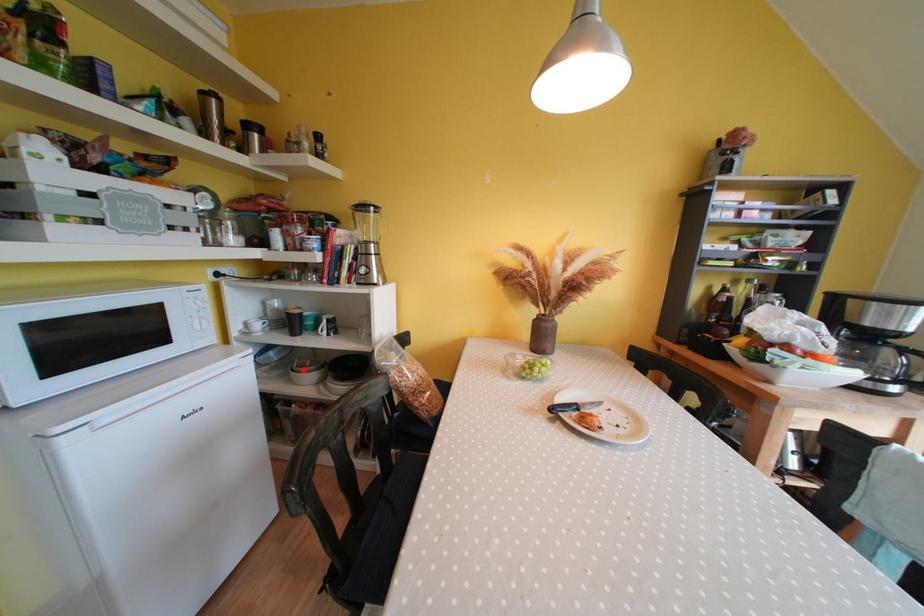
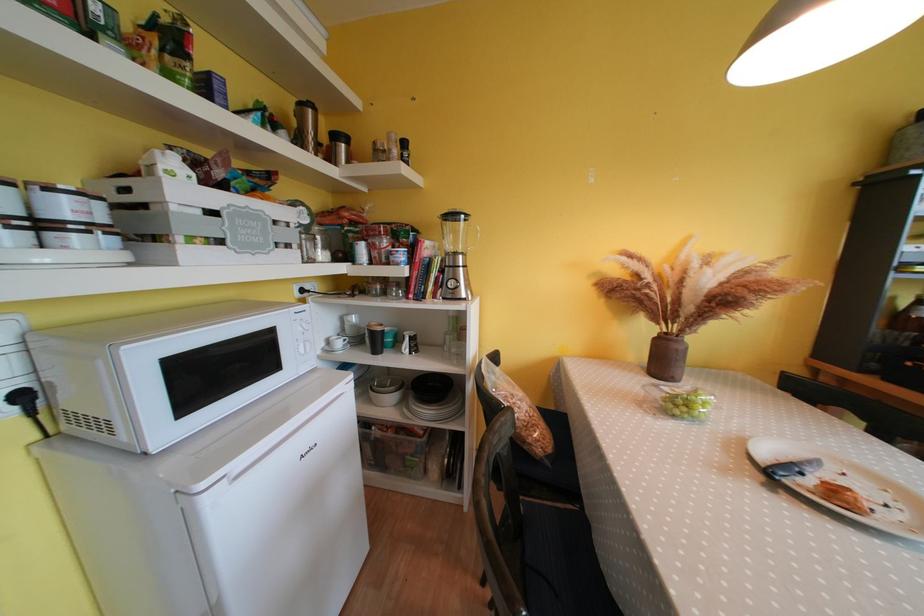
Where in the second image is the point corresponding to the highlighted location from the first image?

(383, 390)